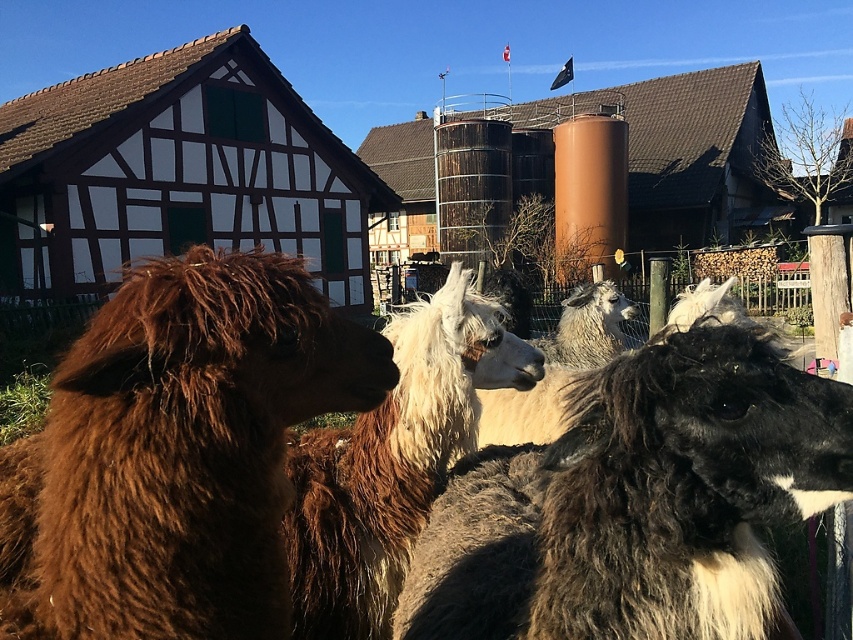
Is brown woolen camel at lower left below black woolly alpaca at center?

Incorrect, brown woolen camel at lower left is not positioned below black woolly alpaca at center.

Between point (849, 484) and point (575, 582), which one is positioned in front?

Point (849, 484) is in front.

Find the location of a particular element. This screenshot has width=853, height=640. brown woolen camel at lower left is located at coordinates (177, 452).

Measure the distance from brown woolen camel at lower left to white woolly alpaca at center.

They are 5.70 feet apart.

Can you confirm if brown woolen camel at lower left is positioned below white woolly alpaca at center?

Yes, brown woolen camel at lower left is below white woolly alpaca at center.

Find the location of a particular element. The width and height of the screenshot is (853, 640). brown woolen camel at lower left is located at coordinates pos(177,452).

Between point (787, 444) and point (358, 484), which one is positioned behind?

The point (358, 484) is behind.

How much distance is there between black woolly alpaca at center and fluffy white alpaca at center?

black woolly alpaca at center and fluffy white alpaca at center are 13.52 inches apart.

Does point (599, 502) come closer to viewer compared to point (471, 412)?

Yes, it is in front of point (471, 412).

Locate an element on the screen. black woolly alpaca at center is located at coordinates (637, 502).